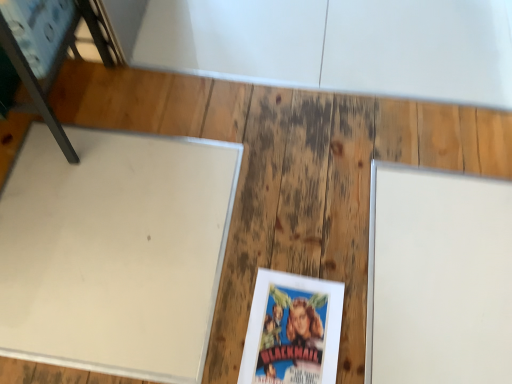
Measure the distance between point (68, 10) and camera.

1.05 meters.

Measure the distance between point [250,323] and camera.

Point [250,323] is 38.70 inches away from camera.

Find the location of a particular element. This screenshot has height=384, width=512. white matte board at right is located at coordinates (438, 277).

Describe the element at coordinates (438, 277) in the screenshot. I see `white matte board at right` at that location.

Identify the location of white matte board at left. (115, 251).

Considering the positions of objects matte paper book at center and white matte board at right in the image provided, who is behind, matte paper book at center or white matte board at right?

white matte board at right is further away from the camera.

Which object is positioned more to the left, matte paper book at center or white matte board at right?

Positioned to the left is matte paper book at center.

In the scene shown: Is matte paper book at center aimed at white matte board at right?

No, matte paper book at center is not facing towards white matte board at right.

Looking at the image, does matte paper book at center seem bigger or smaller compared to white matte board at right?

Clearly, matte paper book at center is smaller in size than white matte board at right.

Is white matte board at right looking in the opposite direction of metallic blue chair at upper left?

No, white matte board at right is not facing the opposite direction of metallic blue chair at upper left.

In the scene shown: Are white matte board at right and metallic blue chair at upper left located far from each other?

No.

Which point is more distant from viewer, (381, 270) or (38, 41)?

The point (381, 270) is more distant.

Consider the image. Does white matte board at right have a lesser height compared to metallic blue chair at upper left?

Yes.

How different are the orientations of matte paper book at center and white matte board at left in degrees?

They differ by 2.42 degrees in their facing directions.

Find the location of a particular element. The height and width of the screenshot is (384, 512). table that appears above the matte paper book at center (from a real-world perspective) is located at coordinates (115, 251).

Is matte paper book at center to the left or to the right of white matte board at left in the image?

In the image, matte paper book at center appears on the right side of white matte board at left.

Is matte paper book at center oriented away from white matte board at left?

No, matte paper book at center is not facing away from white matte board at left.

Is white matte board at right thinner than white matte board at left?

Yes.

Can you confirm if white matte board at right is taller than white matte board at left?

Yes.

Which is behind, point (408, 236) or point (179, 185)?

The point (179, 185) is farther from the camera.

Does metallic blue chair at upper left turn towards matte paper book at center?

No, metallic blue chair at upper left is not aimed at matte paper book at center.

The height and width of the screenshot is (384, 512). What are the coordinates of `paperback book below the metallic blue chair at upper left (from the image's perspective)` in the screenshot? It's located at (292, 330).

Considering the sizes of objects white matte board at left and metallic blue chair at upper left in the image provided, who is taller, white matte board at left or metallic blue chair at upper left?

With more height is metallic blue chair at upper left.

Considering the relative positions of white matte board at left and metallic blue chair at upper left in the image provided, is white matte board at left to the left of metallic blue chair at upper left from the viewer's perspective?

No, white matte board at left is not to the left of metallic blue chair at upper left.

Considering the relative sizes of white matte board at left and metallic blue chair at upper left in the image provided, is white matte board at left bigger than metallic blue chair at upper left?

Incorrect, white matte board at left is not larger than metallic blue chair at upper left.

Can you confirm if white matte board at left is wider than metallic blue chair at upper left?

Correct, the width of white matte board at left exceeds that of metallic blue chair at upper left.

Measure the distance from metallic blue chair at upper left to white matte board at right.

The distance of metallic blue chair at upper left from white matte board at right is 37.28 inches.

Is metallic blue chair at upper left at the left side of white matte board at right?

Yes, metallic blue chair at upper left is to the left of white matte board at right.

Which object is wider, metallic blue chair at upper left or white matte board at right?

With larger width is white matte board at right.

Considering the relative sizes of metallic blue chair at upper left and white matte board at right in the image provided, is metallic blue chair at upper left taller than white matte board at right?

Yes, metallic blue chair at upper left is taller than white matte board at right.

This screenshot has width=512, height=384. In order to click on bulletin board located behind the matte paper book at center in this screenshot , I will do `click(438, 277)`.

In order to click on furniture located on the left of white matte board at right in this screenshot , I will do `click(46, 48)`.

When comparing their distances from white matte board at right, does white matte board at left or metallic blue chair at upper left seem closer?

white matte board at left is positioned closer to the anchor white matte board at right.

Which object lies further to the anchor point white matte board at left, metallic blue chair at upper left or matte paper book at center?

matte paper book at center is positioned further to the anchor white matte board at left.

Estimate the real-world distances between objects in this image. Which object is closer to matte paper book at center, white matte board at right or metallic blue chair at upper left?

Among the two, white matte board at right is located nearer to matte paper book at center.

Considering their positions, is matte paper book at center positioned further to white matte board at left than metallic blue chair at upper left?

matte paper book at center is positioned further to the anchor white matte board at left.

Consider the image. Based on their spatial positions, is white matte board at left or matte paper book at center closer to metallic blue chair at upper left?

The object closer to metallic blue chair at upper left is white matte board at left.

When comparing their distances from matte paper book at center, does metallic blue chair at upper left or white matte board at right seem further?

metallic blue chair at upper left is positioned further to the anchor matte paper book at center.

Based on their spatial positions, is matte paper book at center or white matte board at right closer to metallic blue chair at upper left?

matte paper book at center.

Looking at the image, which one is located further to metallic blue chair at upper left, white matte board at right or matte paper book at center?

white matte board at right is further to metallic blue chair at upper left.

At what (x,y) coordinates should I click in order to perform the action: click on table located between metallic blue chair at upper left and white matte board at right in the left-right direction. Please return your answer as a coordinate pair (x, y). Looking at the image, I should click on (115, 251).

Image resolution: width=512 pixels, height=384 pixels. I want to click on table between metallic blue chair at upper left and matte paper book at center from top to bottom, so click(x=115, y=251).

Where is `paperback book situated between metallic blue chair at upper left and white matte board at right from left to right`? This screenshot has height=384, width=512. paperback book situated between metallic blue chair at upper left and white matte board at right from left to right is located at coordinates (292, 330).

Where is `paperback book between white matte board at left and white matte board at right in the horizontal direction`? Image resolution: width=512 pixels, height=384 pixels. paperback book between white matte board at left and white matte board at right in the horizontal direction is located at coordinates (292, 330).